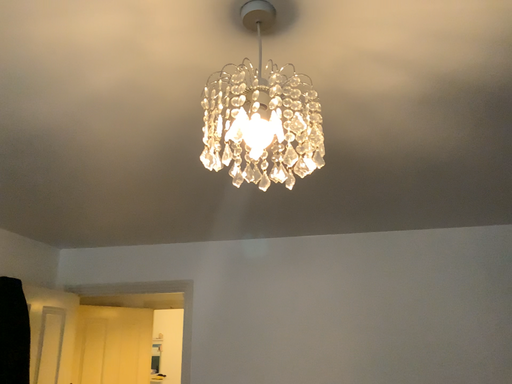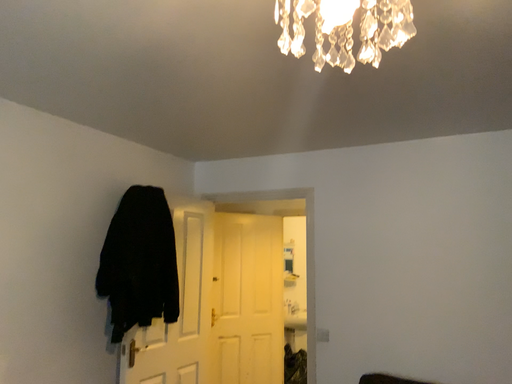
Question: How did the camera likely rotate when shooting the video?

Choices:
 (A) rotated left
 (B) rotated right

Answer: (A)